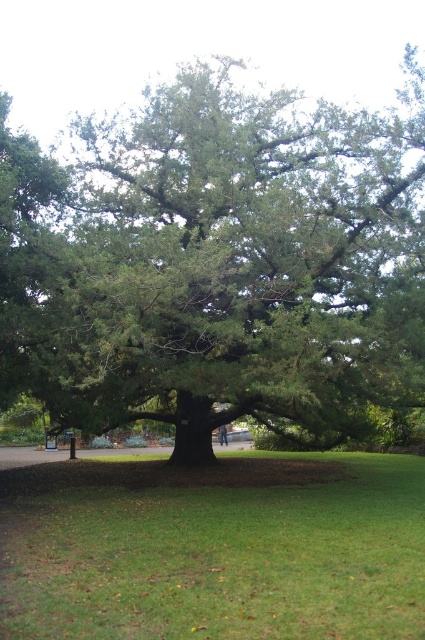
Which is below, green leafy tree at center or green grass at center?

green grass at center is lower down.

Who is more forward, (340, 221) or (17, 628)?

Positioned in front is point (17, 628).

Who is more forward, (393, 333) or (11, 538)?

Positioned in front is point (11, 538).

At what (x,y) coordinates should I click in order to perform the action: click on green leafy tree at center. Please return your answer as a coordinate pair (x, y). Looking at the image, I should click on (218, 264).